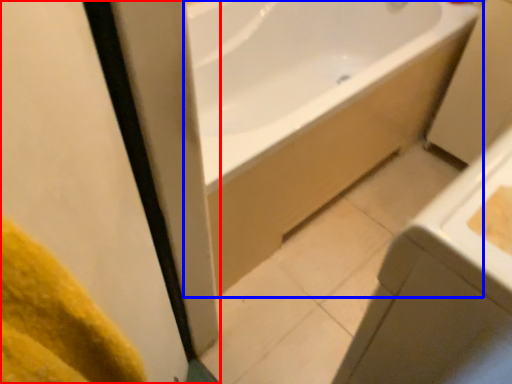
Question: Among these objects, which one is farthest to the camera, screen door (highlighted by a red box) or bathtub (highlighted by a blue box)?

Choices:
 (A) screen door
 (B) bathtub

Answer: (B)